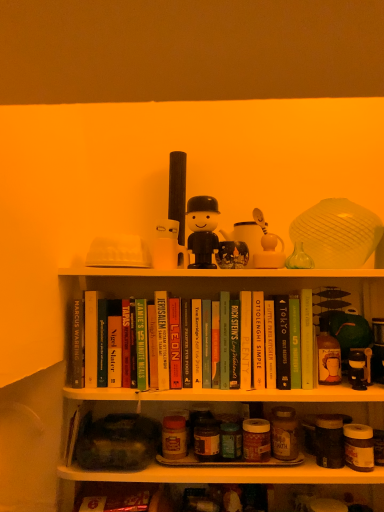
Locate an element on the screen. The width and height of the screenshot is (384, 512). unoccupied area in front of hardcover book at center, which is the twelfth paperback book from right to left is located at coordinates (148, 388).